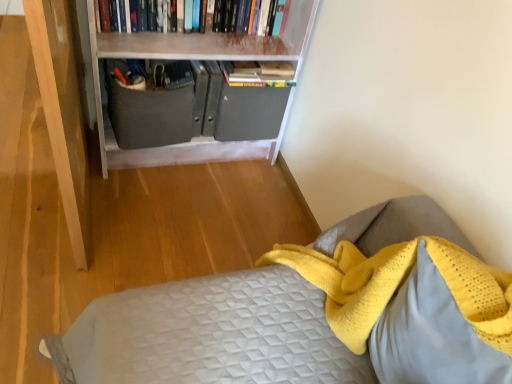
Question: From a real-world perspective, is white matte bookcase at upper center beneath yellow knitted pillow at lower right?

Choices:
 (A) no
 (B) yes

Answer: (B)

Question: Is white matte bookcase at upper center surrounding yellow knitted pillow at lower right?

Choices:
 (A) yes
 (B) no

Answer: (B)

Question: Does white matte bookcase at upper center appear on the right side of yellow knitted pillow at lower right?

Choices:
 (A) yes
 (B) no

Answer: (B)

Question: Is white matte bookcase at upper center directly adjacent to yellow knitted pillow at lower right?

Choices:
 (A) no
 (B) yes

Answer: (A)

Question: Considering the relative sizes of white matte bookcase at upper center and yellow knitted pillow at lower right in the image provided, is white matte bookcase at upper center thinner than yellow knitted pillow at lower right?

Choices:
 (A) no
 (B) yes

Answer: (A)

Question: Would you say yellow knitted pillow at lower right is to the left or to the right of white matte bookcase at upper center in the picture?

Choices:
 (A) right
 (B) left

Answer: (A)

Question: From their relative heights in the image, would you say yellow knitted pillow at lower right is taller or shorter than white matte bookcase at upper center?

Choices:
 (A) short
 (B) tall

Answer: (A)

Question: From the image's perspective, is yellow knitted pillow at lower right located above or below white matte bookcase at upper center?

Choices:
 (A) below
 (B) above

Answer: (A)

Question: Considering the positions of yellow knitted pillow at lower right and white matte bookcase at upper center in the image, is yellow knitted pillow at lower right bigger or smaller than white matte bookcase at upper center?

Choices:
 (A) big
 (B) small

Answer: (B)

Question: Looking at their shapes, would you say hardcover books at upper center is wider or thinner than yellow knitted pillow at lower right?

Choices:
 (A) thin
 (B) wide

Answer: (A)

Question: Is hardcover books at upper center in front of or behind yellow knitted pillow at lower right in the image?

Choices:
 (A) behind
 (B) front

Answer: (A)

Question: From the image's perspective, is hardcover books at upper center above or below yellow knitted pillow at lower right?

Choices:
 (A) below
 (B) above

Answer: (B)

Question: In terms of height, does hardcover books at upper center look taller or shorter compared to yellow knitted pillow at lower right?

Choices:
 (A) short
 (B) tall

Answer: (A)

Question: From the image's perspective, is hardcover books at upper center above or below white matte bookcase at upper center?

Choices:
 (A) below
 (B) above

Answer: (B)

Question: Based on their sizes in the image, would you say hardcover books at upper center is bigger or smaller than white matte bookcase at upper center?

Choices:
 (A) small
 (B) big

Answer: (A)